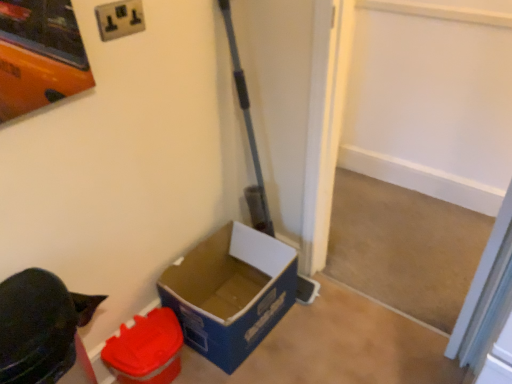
Question: From the image's perspective, is blue cardboard box at lower left, the 2th box from the left, above white plastic electric outlet at upper center?

Choices:
 (A) yes
 (B) no

Answer: (B)

Question: Is blue cardboard box at lower left, arranged as the 1th box when viewed from the right, positioned behind white plastic electric outlet at upper center?

Choices:
 (A) no
 (B) yes

Answer: (B)

Question: Does blue cardboard box at lower left, arranged as the 1th box when viewed from the right, appear on the right side of white plastic electric outlet at upper center?

Choices:
 (A) yes
 (B) no

Answer: (A)

Question: From the image's perspective, is blue cardboard box at lower left, the 2th box from the left, under white plastic electric outlet at upper center?

Choices:
 (A) no
 (B) yes

Answer: (B)

Question: From a real-world perspective, is blue cardboard box at lower left, arranged as the 1th box when viewed from the right, located beneath white plastic electric outlet at upper center?

Choices:
 (A) yes
 (B) no

Answer: (A)

Question: Does blue cardboard box at lower left, the 2th box from the left, appear on the left side of white plastic electric outlet at upper center?

Choices:
 (A) yes
 (B) no

Answer: (B)

Question: Can you confirm if matte plastic container at lower left, the second box in the right-to-left sequence, is wider than white plastic electric outlet at upper center?

Choices:
 (A) yes
 (B) no

Answer: (A)

Question: Considering the relative sizes of matte plastic container at lower left, the 1th box viewed from the left, and white plastic electric outlet at upper center in the image provided, is matte plastic container at lower left, the 1th box viewed from the left, thinner than white plastic electric outlet at upper center?

Choices:
 (A) yes
 (B) no

Answer: (B)

Question: Is matte plastic container at lower left, the second box in the right-to-left sequence, in front of white plastic electric outlet at upper center?

Choices:
 (A) yes
 (B) no

Answer: (B)

Question: Can you confirm if matte plastic container at lower left, the second box in the right-to-left sequence, is taller than white plastic electric outlet at upper center?

Choices:
 (A) no
 (B) yes

Answer: (B)

Question: Is matte plastic container at lower left, the second box in the right-to-left sequence, shorter than white plastic electric outlet at upper center?

Choices:
 (A) yes
 (B) no

Answer: (B)

Question: From a real-world perspective, is matte plastic container at lower left, the 1th box viewed from the left, under white plastic electric outlet at upper center?

Choices:
 (A) no
 (B) yes

Answer: (B)

Question: Would you say matte plastic container at lower left, the 1th box viewed from the left, is a long distance from blue cardboard box at lower left, arranged as the 1th box when viewed from the right?

Choices:
 (A) no
 (B) yes

Answer: (A)